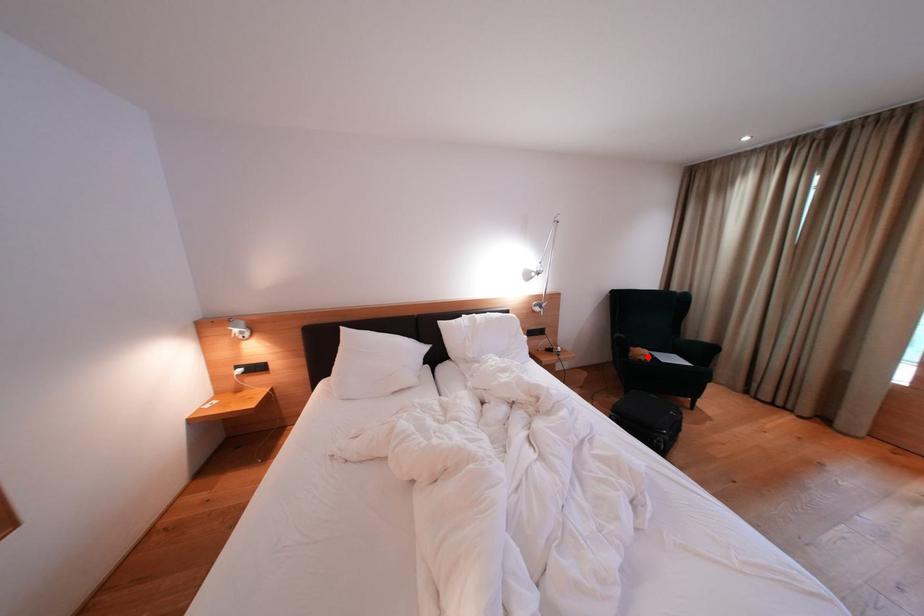
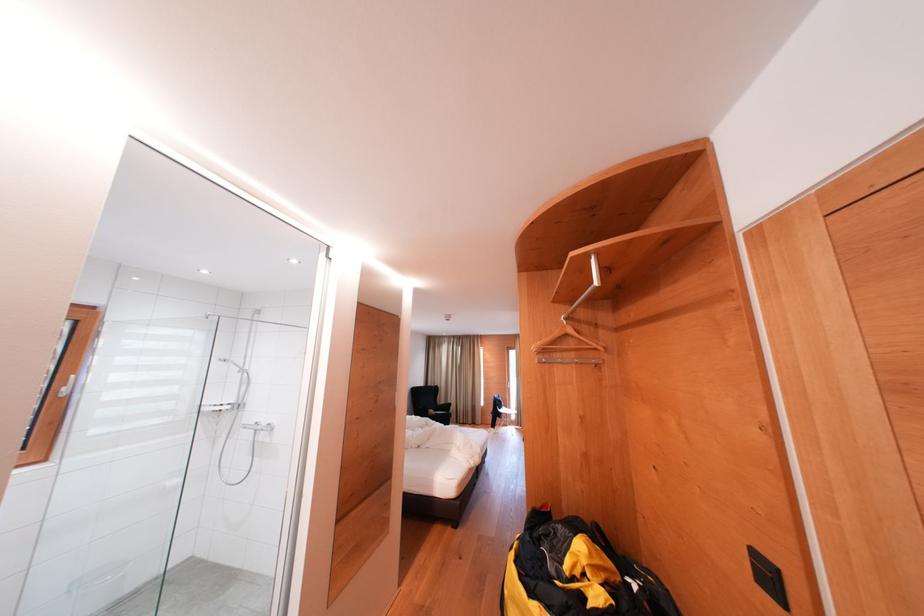
Where in the second image is the point corresponding to the highlighted location from the first image?

(439, 416)